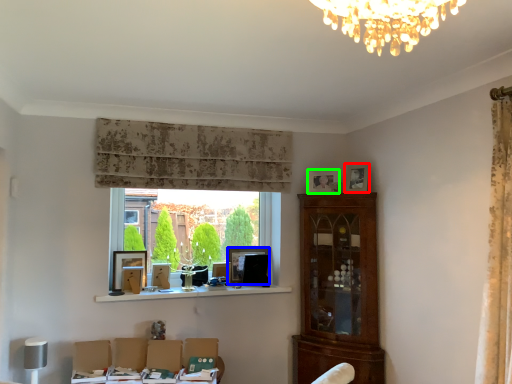
Question: Estimate the real-world distances between objects in this image. Which object is closer to picture frame (highlighted by a red box), picture frame (highlighted by a blue box) or picture frame (highlighted by a green box)?

Choices:
 (A) picture frame
 (B) picture frame

Answer: (B)